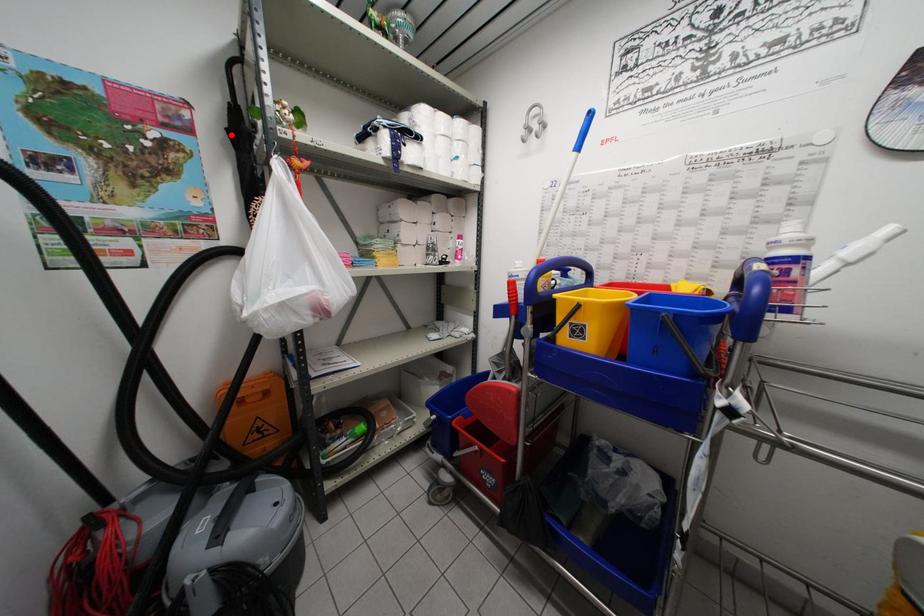
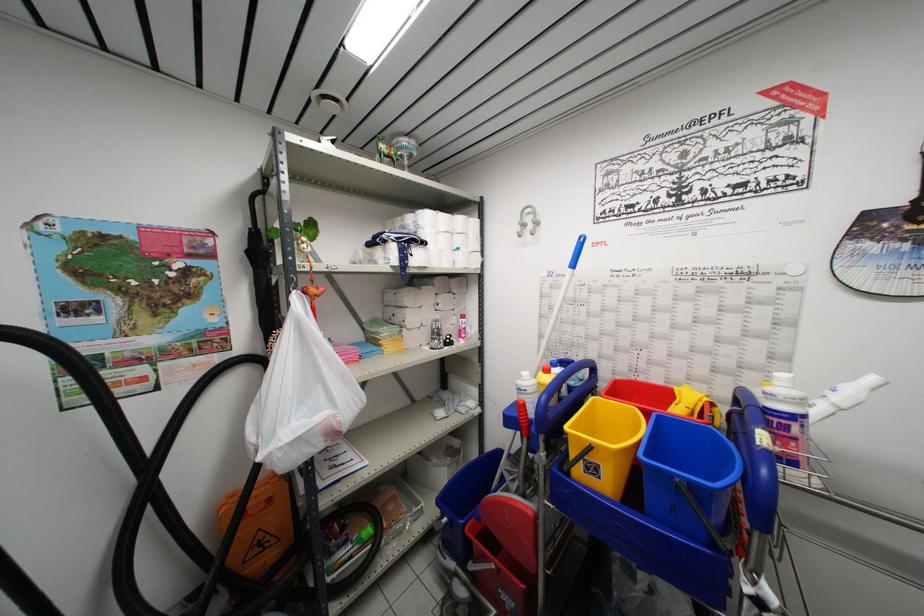
Where in the second image is the point corresponding to the highlighted location from the first image?

(250, 257)